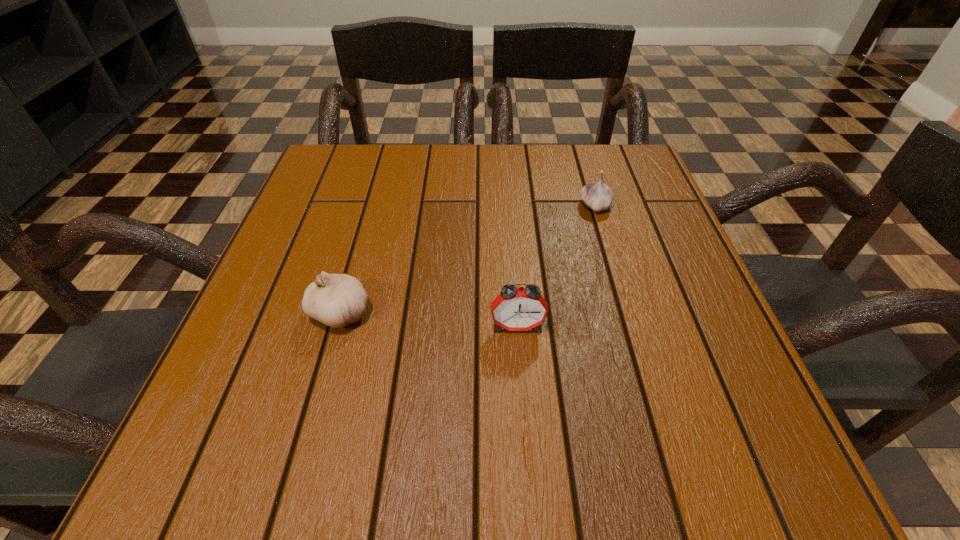
Locate an element on the screen. The width and height of the screenshot is (960, 540). blank space that satisfies the following two spatial constraints: 1. on the back side of the left garlic; 2. on the left side of the farther garlic is located at coordinates (371, 206).